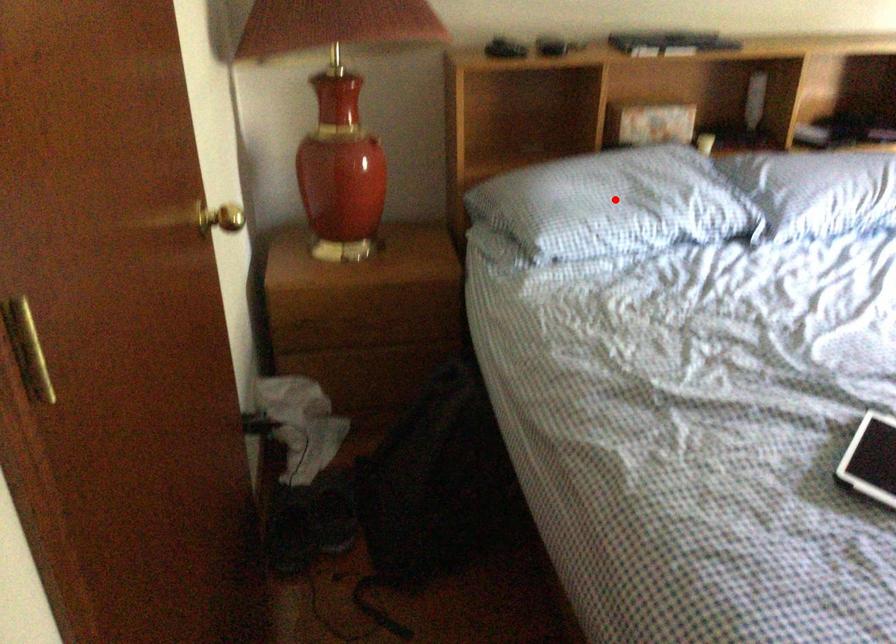
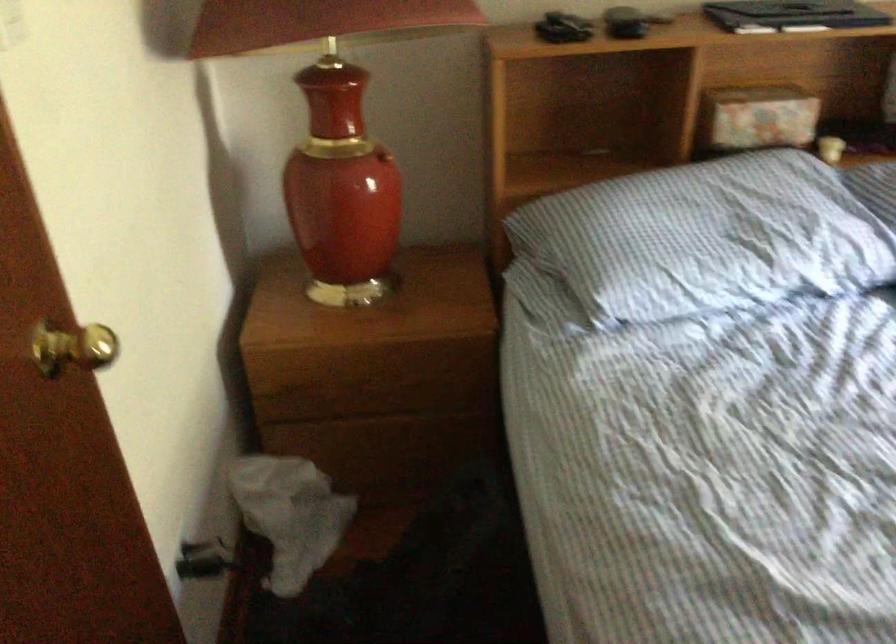
Locate, in the second image, the point that corresponds to the highlighted location in the first image.

(707, 238)